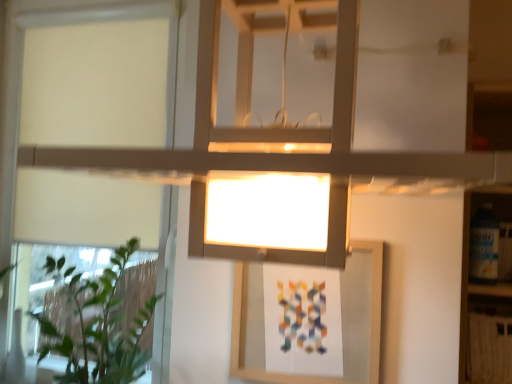
Question: Is point (105, 375) positioned closer to the camera than point (87, 11)?

Choices:
 (A) farther
 (B) closer

Answer: (B)

Question: Considering the positions of green leafy plant at left and white matte window at upper left in the image, is green leafy plant at left taller or shorter than white matte window at upper left?

Choices:
 (A) tall
 (B) short

Answer: (B)

Question: In the image, is green leafy plant at left on the left side or the right side of white matte window at upper left?

Choices:
 (A) right
 (B) left

Answer: (A)

Question: Considering the positions of white matte window at upper left and green leafy plant at left in the image, is white matte window at upper left bigger or smaller than green leafy plant at left?

Choices:
 (A) big
 (B) small

Answer: (B)

Question: Would you say white matte window at upper left is to the left or to the right of green leafy plant at left in the picture?

Choices:
 (A) right
 (B) left

Answer: (B)

Question: From a real-world perspective, is white matte window at upper left positioned above or below green leafy plant at left?

Choices:
 (A) below
 (B) above

Answer: (B)

Question: Is white matte window at upper left situated inside green leafy plant at left or outside?

Choices:
 (A) inside
 (B) outside

Answer: (B)